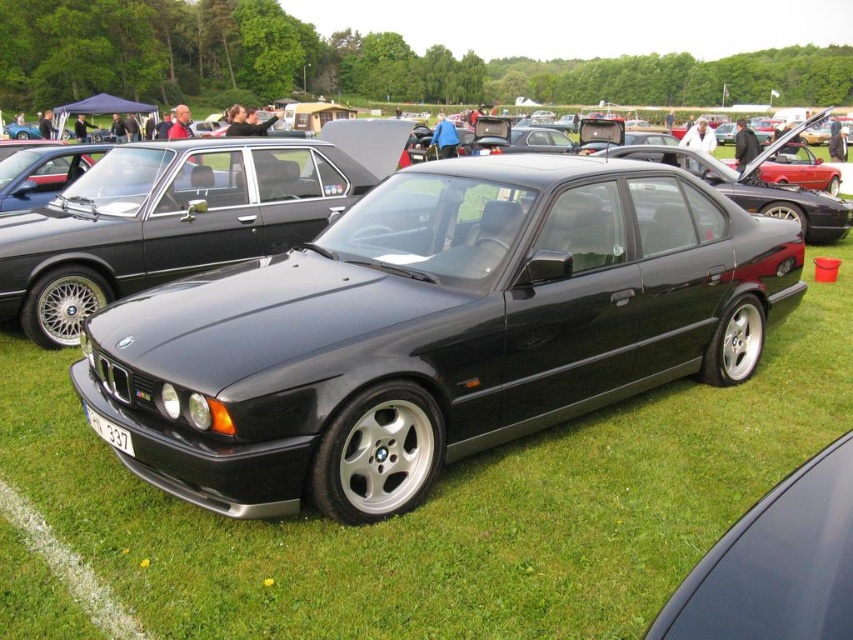
Question: Among these points, which one is farthest from the camera?

Choices:
 (A) (109, 429)
 (B) (230, 209)

Answer: (B)

Question: Which of the following is the closest to the observer?

Choices:
 (A) (277, 145)
 (B) (131, 454)

Answer: (B)

Question: Is the position of black metallic sedan at center more distant than that of white plastic license plate at lower center?

Choices:
 (A) no
 (B) yes

Answer: (B)

Question: Does black metallic sedan at center have a greater width compared to white plastic license plate at lower center?

Choices:
 (A) yes
 (B) no

Answer: (A)

Question: Does black metallic sedan at center have a larger size compared to white plastic license plate at lower center?

Choices:
 (A) no
 (B) yes

Answer: (B)